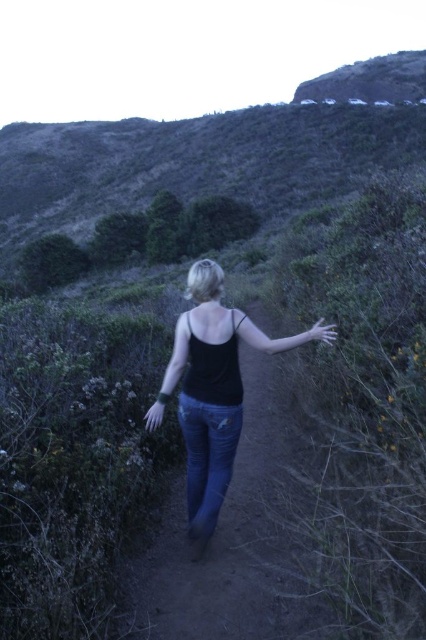
Does black matte tank top at center appear on the right side of denim at center?

Correct, you'll find black matte tank top at center to the right of denim at center.

Between black matte tank top at center and denim at center, which one appears on the right side from the viewer's perspective?

Positioned to the right is black matte tank top at center.

What do you see at coordinates (213, 388) in the screenshot? The image size is (426, 640). I see `black matte tank top at center` at bounding box center [213, 388].

Find the location of a particular element. The image size is (426, 640). black matte tank top at center is located at coordinates (213, 388).